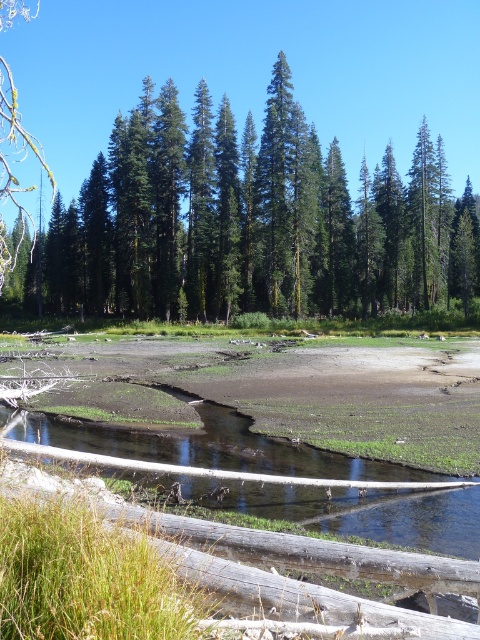
Question: Does green matte tree at center have a larger size compared to brown wood log at lower center?

Choices:
 (A) yes
 (B) no

Answer: (A)

Question: Which point is closer to the camera?

Choices:
 (A) green matte tree at center
 (B) brown wood log at lower center

Answer: (B)

Question: Among these points, which one is nearest to the camera?

Choices:
 (A) pos(260,445)
 (B) pos(429,150)

Answer: (A)

Question: Is green matte tree at center closer to the viewer compared to brown wood log at lower center?

Choices:
 (A) no
 (B) yes

Answer: (A)

Question: Can you confirm if green matte tree at center is positioned below brown wood log at lower center?

Choices:
 (A) yes
 (B) no

Answer: (B)